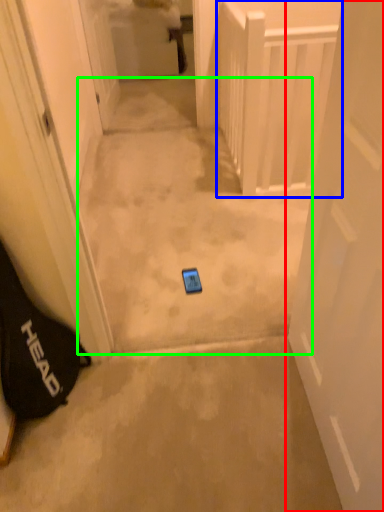
Question: Estimate the real-world distances between objects in this image. Which object is closer to door (highlighted by a red box), balustrade (highlighted by a blue box) or path (highlighted by a green box)?

Choices:
 (A) balustrade
 (B) path

Answer: (B)